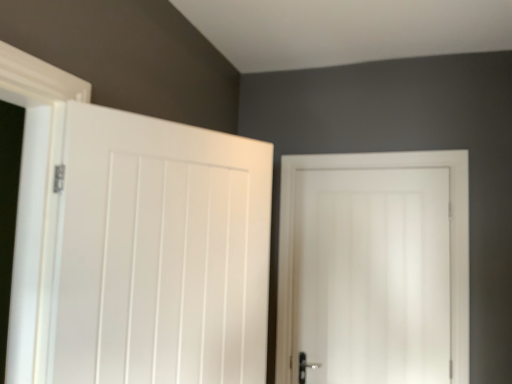
This screenshot has width=512, height=384. What are the coordinates of `white matte door at center, the 1th door when ordered from right to left` in the screenshot? It's located at (450, 240).

What do you see at coordinates (450, 240) in the screenshot?
I see `white matte door at center, the 1th door when ordered from right to left` at bounding box center [450, 240].

Where is `white matte door at left, which is the 1th door from left to right`? white matte door at left, which is the 1th door from left to right is located at coordinates (160, 252).

Describe the element at coordinates (160, 252) in the screenshot. The width and height of the screenshot is (512, 384). I see `white matte door at left, the second door in the back-to-front sequence` at that location.

Where is `white matte door at center, marked as the second door in a left-to-right arrangement`? white matte door at center, marked as the second door in a left-to-right arrangement is located at coordinates coord(450,240).

Based on their positions, is white matte door at center, arranged as the 2th door when viewed from the front, located to the left or right of white matte door at left, the first door in the front-to-back sequence?

In the image, white matte door at center, arranged as the 2th door when viewed from the front, appears on the right side of white matte door at left, the first door in the front-to-back sequence.

Is white matte door at center, arranged as the 2th door when viewed from the front, in front of or behind white matte door at left, which is the 1th door from left to right, in the image?

Visually, white matte door at center, arranged as the 2th door when viewed from the front, is located behind white matte door at left, which is the 1th door from left to right.

Does point (285, 325) come closer to viewer compared to point (85, 191)?

No.

From the image's perspective, relative to white matte door at left, marked as the second door in a right-to-left arrangement, is white matte door at center, marked as the second door in a left-to-right arrangement, above or below?

Clearly, from the image's perspective, white matte door at center, marked as the second door in a left-to-right arrangement, is below white matte door at left, marked as the second door in a right-to-left arrangement.

From a real-world perspective, is white matte door at center, arranged as the 2th door when viewed from the front, over white matte door at left, the second door in the back-to-front sequence?

No, from a real-world perspective, white matte door at center, arranged as the 2th door when viewed from the front, is not on top of white matte door at left, the second door in the back-to-front sequence.

Between white matte door at center, the 1th door when ordered from right to left, and white matte door at left, the first door in the front-to-back sequence, which one has smaller width?

white matte door at center, the 1th door when ordered from right to left, is thinner.

Considering the sizes of objects white matte door at center, marked as the second door in a left-to-right arrangement, and white matte door at left, which is the 1th door from left to right, in the image provided, who is taller, white matte door at center, marked as the second door in a left-to-right arrangement, or white matte door at left, which is the 1th door from left to right,?

white matte door at center, marked as the second door in a left-to-right arrangement, is taller.

Who is smaller, white matte door at center, arranged as the 2th door when viewed from the front, or white matte door at left, the first door in the front-to-back sequence?

white matte door at center, arranged as the 2th door when viewed from the front.

Would you say white matte door at center, arranged as the 2th door when viewed from the front, is outside white matte door at left, the second door in the back-to-front sequence?

Yes.

Is white matte door at center, marked as the 1th door in a back-to-front arrangement, not near white matte door at left, the second door in the back-to-front sequence?

white matte door at center, marked as the 1th door in a back-to-front arrangement, is actually quite close to white matte door at left, the second door in the back-to-front sequence.

Is white matte door at center, the 1th door when ordered from right to left, looking in the opposite direction of white matte door at left, marked as the second door in a right-to-left arrangement?

That's not correct — white matte door at center, the 1th door when ordered from right to left, is not looking away from white matte door at left, marked as the second door in a right-to-left arrangement.

How different are the orientations of white matte door at center, marked as the 1th door in a back-to-front arrangement, and white matte door at left, marked as the second door in a right-to-left arrangement, in degrees?

59.4 degrees separate the facing orientations of white matte door at center, marked as the 1th door in a back-to-front arrangement, and white matte door at left, marked as the second door in a right-to-left arrangement.

Where is `door on the left of white matte door at center, the 1th door when ordered from right to left`? The width and height of the screenshot is (512, 384). door on the left of white matte door at center, the 1th door when ordered from right to left is located at coordinates (160, 252).

Can you confirm if white matte door at left, the second door in the back-to-front sequence, is positioned to the left of white matte door at center, marked as the 1th door in a back-to-front arrangement?

Indeed, white matte door at left, the second door in the back-to-front sequence, is positioned on the left side of white matte door at center, marked as the 1th door in a back-to-front arrangement.

Considering their positions, is white matte door at left, which is the 1th door from left to right, located in front of or behind white matte door at center, marked as the second door in a left-to-right arrangement?

white matte door at left, which is the 1th door from left to right, is positioned closer to the viewer than white matte door at center, marked as the second door in a left-to-right arrangement.

Is point (69, 151) positioned in front of point (281, 317)?

Yes, it is in front of point (281, 317).

From the image's perspective, is white matte door at left, marked as the second door in a right-to-left arrangement, above or below white matte door at center, the 1th door when ordered from right to left?

Based on their image positions, white matte door at left, marked as the second door in a right-to-left arrangement, is located above white matte door at center, the 1th door when ordered from right to left.

From a real-world perspective, which object stands above the other?

In real-world perspective, white matte door at left, the first door in the front-to-back sequence, is above.

Can you confirm if white matte door at left, the first door in the front-to-back sequence, is wider than white matte door at center, the 1th door when ordered from right to left?

Yes.

Considering the sizes of white matte door at left, the first door in the front-to-back sequence, and white matte door at center, marked as the 1th door in a back-to-front arrangement, in the image, is white matte door at left, the first door in the front-to-back sequence, taller or shorter than white matte door at center, marked as the 1th door in a back-to-front arrangement,?

In the image, white matte door at left, the first door in the front-to-back sequence, appears to be shorter than white matte door at center, marked as the 1th door in a back-to-front arrangement.

Is white matte door at left, marked as the second door in a right-to-left arrangement, smaller than white matte door at center, marked as the 1th door in a back-to-front arrangement?

No, white matte door at left, marked as the second door in a right-to-left arrangement, is not smaller than white matte door at center, marked as the 1th door in a back-to-front arrangement.

Can we say white matte door at left, which is the 1th door from left to right, lies outside white matte door at center, marked as the second door in a left-to-right arrangement?

Absolutely, white matte door at left, which is the 1th door from left to right, is external to white matte door at center, marked as the second door in a left-to-right arrangement.

Does white matte door at left, which is the 1th door from left to right, touch white matte door at center, marked as the 1th door in a back-to-front arrangement?

No, white matte door at left, which is the 1th door from left to right, is not beside white matte door at center, marked as the 1th door in a back-to-front arrangement.

Is white matte door at left, marked as the second door in a right-to-left arrangement, oriented towards white matte door at center, marked as the second door in a left-to-right arrangement?

No, white matte door at left, marked as the second door in a right-to-left arrangement, is not facing towards white matte door at center, marked as the second door in a left-to-right arrangement.

What are the coordinates of `door on the right of white matte door at left, which is the 1th door from left to right` in the screenshot? It's located at [x=450, y=240].

This screenshot has height=384, width=512. In order to click on door behind the white matte door at left, the second door in the back-to-front sequence in this screenshot , I will do `click(450, 240)`.

I want to click on door lying in front of the white matte door at center, arranged as the 2th door when viewed from the front, so click(x=160, y=252).